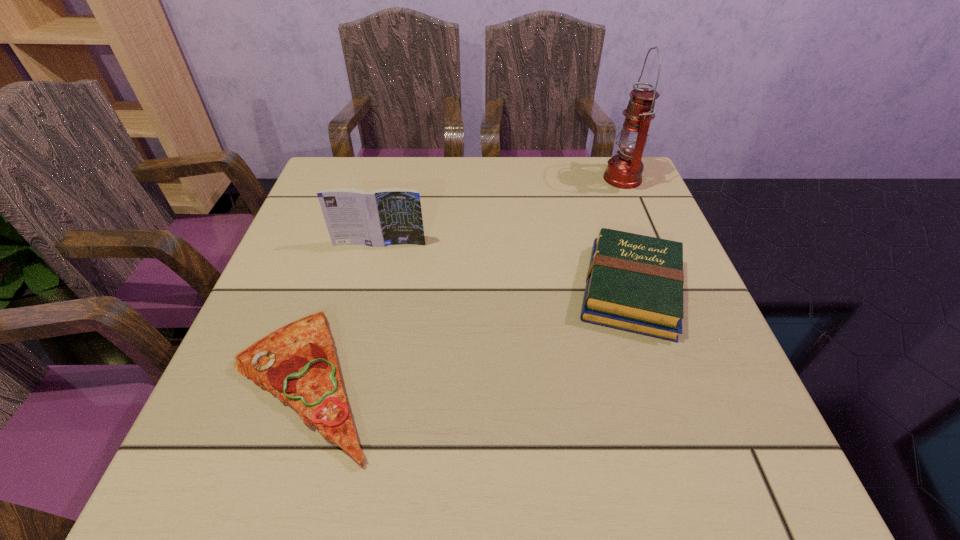
I want to click on free location that satisfies the following two spatial constraints: 1. on the front cover of the left book; 2. on the left side of the right book, so click(x=369, y=289).

The width and height of the screenshot is (960, 540). I want to click on vacant area that satisfies the following two spatial constraints: 1. on the back side of the farthest object; 2. on the right side of the third tallest object, so click(x=593, y=178).